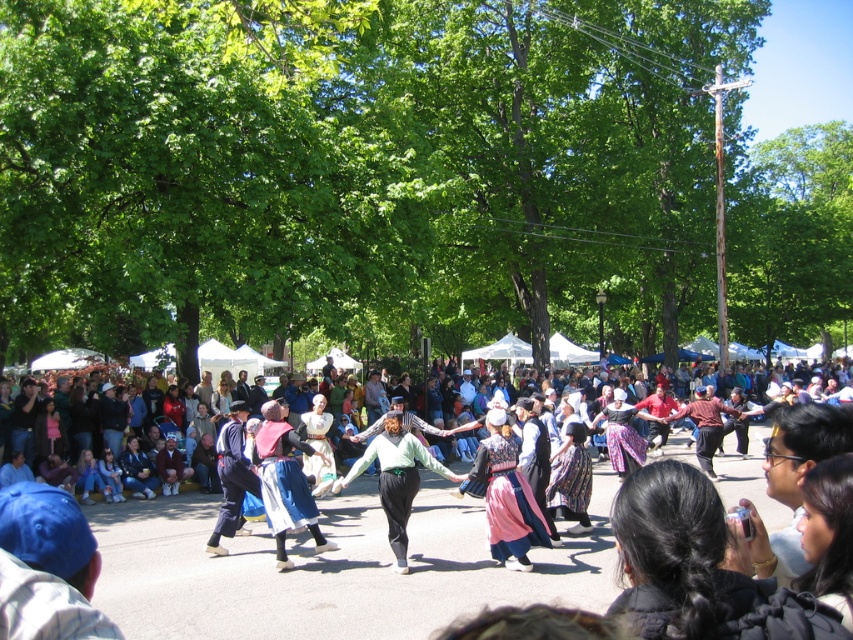
Based on the photo, you are organizing a costume display and need to arrange the silk skirt at center and the green fabric skirt at center side by side. Based on their sizes, which one should be placed first to ensure both fit in the display area?

The silk skirt at center occupies less space than the green fabric skirt at center, so place the silk skirt at center first to accommodate the larger green fabric skirt at center afterward.

You are a photographer at the event and want to capture the green fabric skirt at center and the multicolored fabric crowd at center in a single frame. Which object will appear smaller in the photo?

The green fabric skirt at center will appear smaller in the photo because it occupies less space than the multicolored fabric crowd at center.